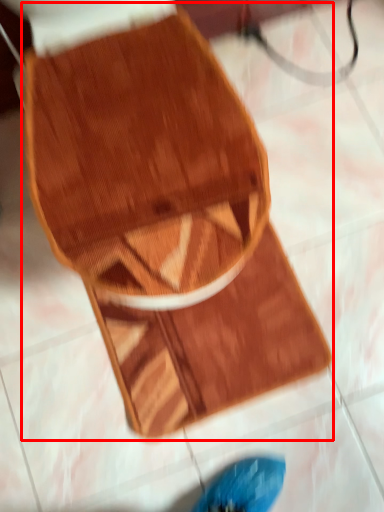
Question: From the image's perspective, where is footwear (annotated by the red box) located relative to mat?

Choices:
 (A) above
 (B) below

Answer: (A)